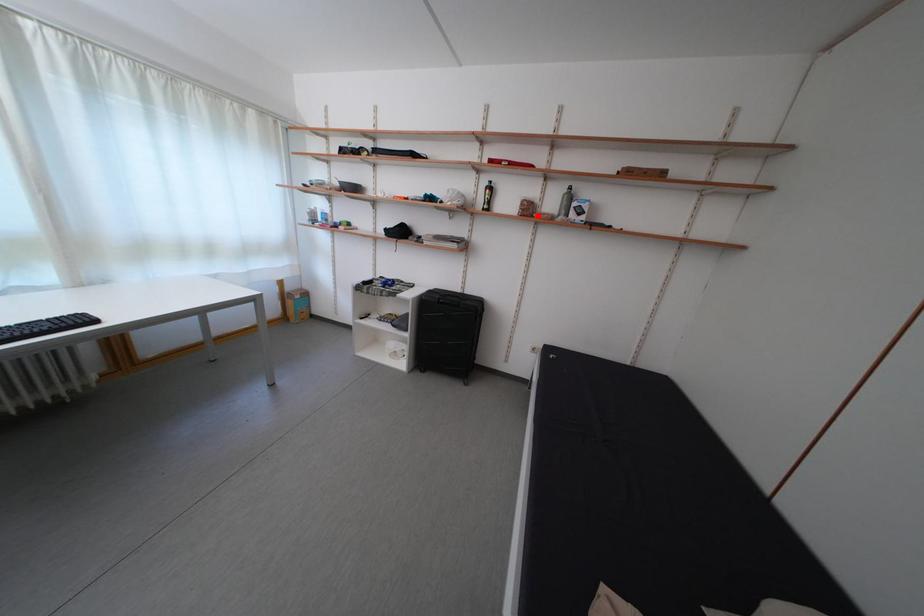
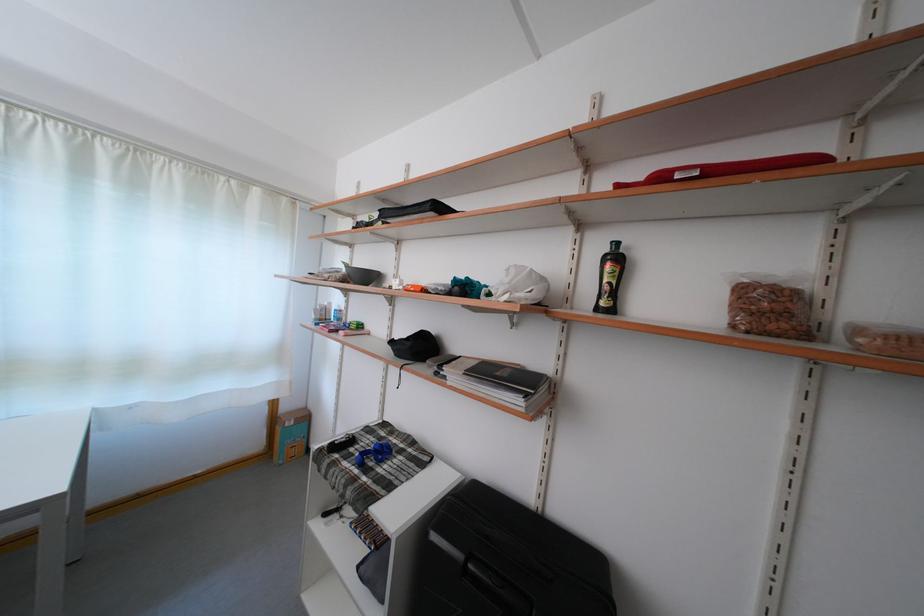
In the second image, find the point that corresponds to the highlighted location in the first image.

(782, 321)